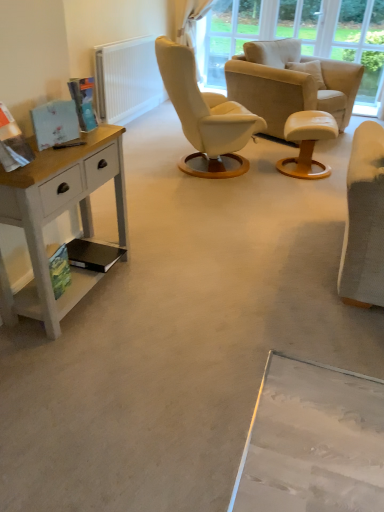
Find the location of a particular element. beige fabric armchair at center is located at coordinates (289, 84).

The width and height of the screenshot is (384, 512). Identify the location of transparent glass window screen at upper center. (228, 35).

Is white painted wood desk at left wider or thinner than white textured radiator at upper left?

white painted wood desk at left is wider than white textured radiator at upper left.

What's the angular difference between white painted wood desk at left and white textured radiator at upper left's facing directions?

The facing directions of white painted wood desk at left and white textured radiator at upper left are 0.849 degrees apart.

How far apart are white painted wood desk at left and white textured radiator at upper left?

→ white painted wood desk at left is 8.04 feet away from white textured radiator at upper left.

Considering their positions, is white painted wood desk at left located in front of or behind white textured radiator at upper left?

white painted wood desk at left is in front of white textured radiator at upper left.

From the picture: From the image's perspective, would you say white leather stool at center is shown under beige fabric armchair at center?

Yes, from the image's perspective, white leather stool at center is beneath beige fabric armchair at center.

Is white leather stool at center looking in the opposite direction of beige fabric armchair at center?

No.

From a real-world perspective, is white leather stool at center physically located above or below beige fabric armchair at center?

Clearly, from a real-world perspective, white leather stool at center is below beige fabric armchair at center.

Which object is positioned more to the left, white leather stool at center or beige fabric armchair at center?

Positioned to the left is white leather stool at center.

Looking at this image, is white leather stool at center bigger or smaller than white textured radiator at upper left?

white leather stool at center is smaller than white textured radiator at upper left.

Could you tell me if white leather stool at center is turned towards white textured radiator at upper left?

No, white leather stool at center is not turned towards white textured radiator at upper left.

In terms of width, does white leather stool at center look wider or thinner when compared to white textured radiator at upper left?

Clearly, white leather stool at center has more width compared to white textured radiator at upper left.

Considering the positions of objects white leather stool at center and white textured radiator at upper left in the image provided, who is in front, white leather stool at center or white textured radiator at upper left?

white leather stool at center is closer to the camera.

Based on their sizes in the image, would you say transparent glass window screen at upper center is bigger or smaller than white leather stool at center?

Clearly, transparent glass window screen at upper center is larger in size than white leather stool at center.

Is white leather stool at center located within transparent glass window screen at upper center?

Definitely not — white leather stool at center is not inside transparent glass window screen at upper center.

Is point (210, 41) closer or farther from the camera than point (333, 122)?

Point (210, 41).

Could you tell me if beige fabric armchair at center is turned towards transparent glass window screen at upper center?

No, beige fabric armchair at center is not facing towards transparent glass window screen at upper center.

From the image's perspective, is beige fabric armchair at center under transparent glass window screen at upper center?

Indeed, from the image's perspective, beige fabric armchair at center is shown beneath transparent glass window screen at upper center.

Is beige fabric armchair at center outside of transparent glass window screen at upper center?

Indeed, beige fabric armchair at center is completely outside transparent glass window screen at upper center.

Find the location of a particular element. chair beneath the transparent glass window screen at upper center (from a real-world perspective) is located at coordinates (289, 84).

In the scene shown: From the image's perspective, between beige fabric armchair at center and white textured radiator at upper left, which one is located above?

white textured radiator at upper left appears higher in the image.

From a real-world perspective, which is physically below, beige fabric armchair at center or white textured radiator at upper left?

In real-world perspective, white textured radiator at upper left is lower.

Is point (328, 66) farther from viewer compared to point (97, 113)?

Yes.

Would you say beige fabric armchair at center is outside white textured radiator at upper left?

Yes.

Is white leather stool at center beside white painted wood desk at left?

They are not placed beside each other.

Considering the relative sizes of white leather stool at center and white painted wood desk at left in the image provided, is white leather stool at center smaller than white painted wood desk at left?

Yes, white leather stool at center is smaller than white painted wood desk at left.

Considering the sizes of objects white leather stool at center and white painted wood desk at left in the image provided, who is wider, white leather stool at center or white painted wood desk at left?

With larger width is white leather stool at center.

Considering the positions of point (305, 147) and point (16, 181), is point (305, 147) closer or farther from the camera than point (16, 181)?

Point (305, 147) appears to be farther away from the viewer than point (16, 181).

At what (x,y) coordinates should I click in order to perform the action: click on radiator that appears above the white painted wood desk at left (from a real-world perspective). Please return your answer as a coordinate pair (x, y). The height and width of the screenshot is (512, 384). Looking at the image, I should click on (127, 80).

Identify the location of stool that is in front of the beige fabric armchair at center. (307, 143).

Based on the photo, based on their spatial positions, is white leather stool at center or white painted wood desk at left further from white textured radiator at upper left?

Among the two, white painted wood desk at left is located further to white textured radiator at upper left.

Based on their spatial positions, is white painted wood desk at left or beige fabric armchair at center further from white textured radiator at upper left?

The object further to white textured radiator at upper left is white painted wood desk at left.

Considering their positions, is beige fabric armchair at center positioned closer to transparent glass window screen at upper center than white leather stool at center?

The object closer to transparent glass window screen at upper center is beige fabric armchair at center.

Considering their positions, is white leather stool at center positioned closer to transparent glass window screen at upper center than white textured radiator at upper left?

Based on the image, white textured radiator at upper left appears to be nearer to transparent glass window screen at upper center.

Which object lies nearer to the anchor point beige fabric armchair at center, transparent glass window screen at upper center or white textured radiator at upper left?

transparent glass window screen at upper center.

Estimate the real-world distances between objects in this image. Which object is closer to beige fabric armchair at center, white painted wood desk at left or transparent glass window screen at upper center?

Among the two, transparent glass window screen at upper center is located nearer to beige fabric armchair at center.

Which object lies further to the anchor point white textured radiator at upper left, transparent glass window screen at upper center or beige fabric armchair at center?

The object further to white textured radiator at upper left is beige fabric armchair at center.

Which object lies nearer to the anchor point white painted wood desk at left, white leather stool at center or transparent glass window screen at upper center?

The object closer to white painted wood desk at left is white leather stool at center.

Find the location of a particular element. chair located between white painted wood desk at left and white textured radiator at upper left in the depth direction is located at coordinates (289, 84).

Image resolution: width=384 pixels, height=512 pixels. In order to click on stool between white painted wood desk at left and white textured radiator at upper left along the z-axis in this screenshot , I will do `click(307, 143)`.

You are a GUI agent. You are given a task and a screenshot of the screen. Output one action in this format:
    pyautogui.click(x=<x>, y=<y>)
    Task: Click on the radiator between beige fabric armchair at center and transparent glass window screen at upper center along the z-axis
    This screenshot has width=384, height=512.
    Given the screenshot: What is the action you would take?
    pyautogui.click(x=127, y=80)

Locate an element on the screen. This screenshot has width=384, height=512. chair positioned between white painted wood desk at left and transparent glass window screen at upper center from near to far is located at coordinates (289, 84).